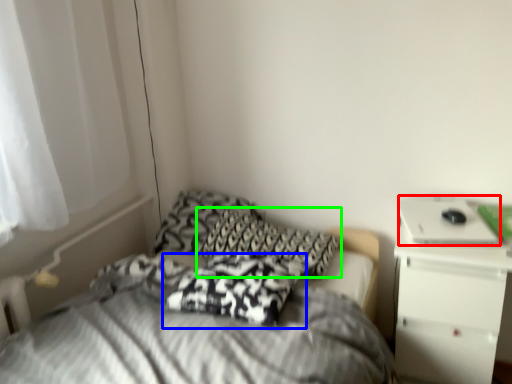
Question: Which is farther away from laptop (highlighted by a red box)? pillow (highlighted by a blue box) or pillow (highlighted by a green box)?

Choices:
 (A) pillow
 (B) pillow

Answer: (A)